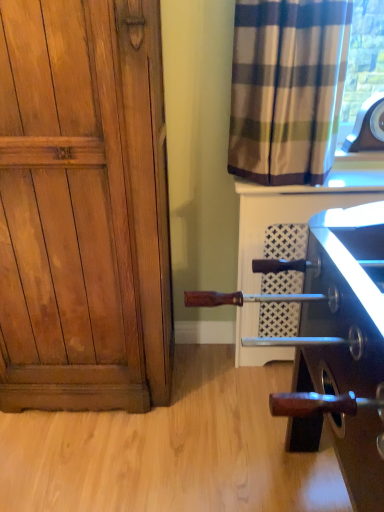
What do you see at coordinates (171, 450) in the screenshot? I see `wooden handle at lower right` at bounding box center [171, 450].

This screenshot has height=512, width=384. What are the coordinates of `white textured tile at upper right` in the screenshot? It's located at pyautogui.click(x=323, y=184).

Locate an element on the screen. wooden handle at lower right is located at coordinates (171, 450).

In the image, is plaid fabric curtain at upper right positioned in front of or behind wooden paneling at left?

In the image, plaid fabric curtain at upper right appears behind wooden paneling at left.

Considering the relative sizes of plaid fabric curtain at upper right and wooden paneling at left in the image provided, is plaid fabric curtain at upper right thinner than wooden paneling at left?

Yes.

Is wooden paneling at left surrounded by plaid fabric curtain at upper right?

No.

Is white textured tile at upper right wider or thinner than plaid fabric curtain at upper right?

white textured tile at upper right is wider than plaid fabric curtain at upper right.

From the image's perspective, which is below, white textured tile at upper right or plaid fabric curtain at upper right?

white textured tile at upper right, from the image's perspective.

Which is more to the left, white textured tile at upper right or plaid fabric curtain at upper right?

plaid fabric curtain at upper right is more to the left.

How much distance is there between white textured tile at upper right and plaid fabric curtain at upper right?

They are 10.06 inches apart.

Measure the distance between wooden handle at lower right and wooden paneling at left.

18.88 inches.

Can you confirm if wooden handle at lower right is shorter than wooden paneling at left?

Correct, wooden handle at lower right is not as tall as wooden paneling at left.

Is wooden handle at lower right outside of wooden paneling at left?

Yes, wooden handle at lower right is outside of wooden paneling at left.

Is wooden handle at lower right thinner than white textured tile at upper right?

No.

Considering the positions of point (238, 384) and point (268, 192), is point (238, 384) closer or farther from the camera than point (268, 192)?

Point (238, 384) is farther from the camera than point (268, 192).

You are a GUI agent. You are given a task and a screenshot of the screen. Output one action in this format:
    pyautogui.click(x=<x>, y=<y>)
    Task: Click on the plain lying in front of the white textured tile at upper right
    
    Given the screenshot: What is the action you would take?
    pyautogui.click(x=171, y=450)

From the image's perspective, is wooden handle at lower right positioned above or below white textured tile at upper right?

wooden handle at lower right is situated lower than white textured tile at upper right in the image.

Which object is closer to the camera taking this photo, white textured tile at upper right or wooden handle at lower right?

Positioned in front is wooden handle at lower right.

Does point (306, 191) come farther from viewer compared to point (245, 452)?

No, (306, 191) is closer to viewer.

Measure the distance between white textured tile at upper right and wooden handle at lower right.

white textured tile at upper right is 37.61 inches away from wooden handle at lower right.

Is white textured tile at upper right aimed at wooden handle at lower right?

No, white textured tile at upper right is not facing towards wooden handle at lower right.

This screenshot has width=384, height=512. In order to click on door to the left of wooden handle at lower right in this screenshot , I will do `click(83, 207)`.

Which of these two, wooden paneling at left or wooden handle at lower right, is thinner?

wooden paneling at left.

Who is smaller, wooden paneling at left or wooden handle at lower right?

With smaller size is wooden handle at lower right.

Can you confirm if plaid fabric curtain at upper right is bigger than white textured tile at upper right?

Correct, plaid fabric curtain at upper right is larger in size than white textured tile at upper right.

Is white textured tile at upper right at the back of plaid fabric curtain at upper right?

No, plaid fabric curtain at upper right's orientation is not away from white textured tile at upper right.

Does point (238, 34) come closer to viewer compared to point (244, 192)?

Yes, point (238, 34) is in front of point (244, 192).

Which object is positioned more to the left, plaid fabric curtain at upper right or white textured tile at upper right?

From the viewer's perspective, plaid fabric curtain at upper right appears more on the left side.

Locate an element on the screen. door that is below the plaid fabric curtain at upper right (from the image's perspective) is located at coordinates (83, 207).

This screenshot has width=384, height=512. What are the coordinates of `curtain in front of the white textured tile at upper right` in the screenshot? It's located at coord(287,89).

In the scene shown: When comparing their distances from plaid fabric curtain at upper right, does white textured tile at upper right or wooden handle at lower right seem closer?

Based on the image, white textured tile at upper right appears to be nearer to plaid fabric curtain at upper right.

Considering their positions, is wooden handle at lower right positioned closer to plaid fabric curtain at upper right than wooden paneling at left?

Among the two, wooden paneling at left is located nearer to plaid fabric curtain at upper right.

Which object lies nearer to the anchor point wooden handle at lower right, white textured tile at upper right or wooden paneling at left?

wooden paneling at left lies closer to wooden handle at lower right than the other object.

When comparing their distances from wooden handle at lower right, does plaid fabric curtain at upper right or wooden paneling at left seem closer?

wooden paneling at left is positioned closer to the anchor wooden handle at lower right.

Considering their positions, is wooden handle at lower right positioned further to wooden paneling at left than plaid fabric curtain at upper right?

Among the two, plaid fabric curtain at upper right is located further to wooden paneling at left.

Estimate the real-world distances between objects in this image. Which object is further from wooden handle at lower right, white textured tile at upper right or plaid fabric curtain at upper right?

Based on the image, plaid fabric curtain at upper right appears to be further to wooden handle at lower right.

Looking at the image, which one is located further to wooden paneling at left, plaid fabric curtain at upper right or wooden handle at lower right?

Based on the image, plaid fabric curtain at upper right appears to be further to wooden paneling at left.

From the image, which object appears to be farther from wooden handle at lower right, plaid fabric curtain at upper right or white textured tile at upper right?

plaid fabric curtain at upper right is positioned further to the anchor wooden handle at lower right.

Where is `door between plaid fabric curtain at upper right and wooden handle at lower right in the vertical direction`? door between plaid fabric curtain at upper right and wooden handle at lower right in the vertical direction is located at coordinates (83, 207).

This screenshot has height=512, width=384. What are the coordinates of `door between white textured tile at upper right and wooden handle at lower right in the up-down direction` in the screenshot? It's located at (83, 207).

You are a GUI agent. You are given a task and a screenshot of the screen. Output one action in this format:
    pyautogui.click(x=<x>, y=<y>)
    Task: Click on the window sill between plaid fabric curtain at upper right and wooden handle at lower right in the vertical direction
    
    Given the screenshot: What is the action you would take?
    pyautogui.click(x=323, y=184)

Locate an element on the screen. Image resolution: width=384 pixels, height=512 pixels. curtain situated between wooden paneling at left and white textured tile at upper right from left to right is located at coordinates (287, 89).